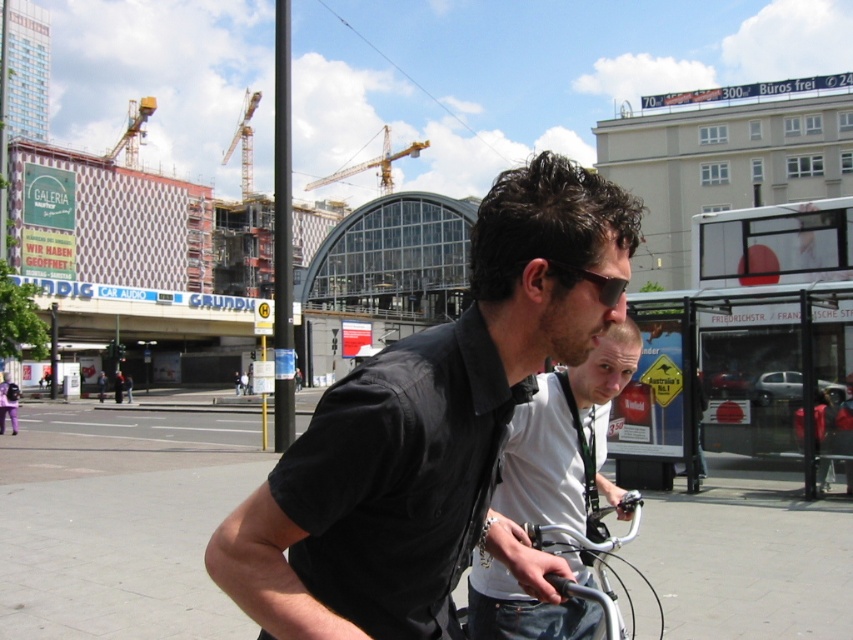
Describe the element at coordinates (430, 432) in the screenshot. The image size is (853, 640). I see `black matte shirt at center` at that location.

Is black matte shirt at center above gray concrete pavement at center?

Yes.

Does point (572, 291) come farther from viewer compared to point (126, 502)?

No, it is in front of (126, 502).

Locate an element on the screen. This screenshot has height=640, width=853. black matte shirt at center is located at coordinates (430, 432).

From the picture: Is black matte shirt at center positioned behind yellow metallic crane at upper left?

That is False.

Is point (283, 596) positioned in front of point (149, 115)?

Yes, point (283, 596) is in front of point (149, 115).

Between point (447, 545) and point (128, 156), which one is positioned behind?

The point (128, 156) is behind.

The height and width of the screenshot is (640, 853). I want to click on black matte shirt at center, so click(x=430, y=432).

Could you measure the distance between gray concrete pavement at center and silver metallic bicycle handlebars at center?

gray concrete pavement at center is 12.11 meters from silver metallic bicycle handlebars at center.

Does gray concrete pavement at center lie in front of silver metallic bicycle handlebars at center?

No, gray concrete pavement at center is further to the viewer.

Between point (10, 605) and point (608, 596), which one is positioned in front?

Point (608, 596) is in front.

This screenshot has width=853, height=640. I want to click on gray concrete pavement at center, so click(x=119, y=522).